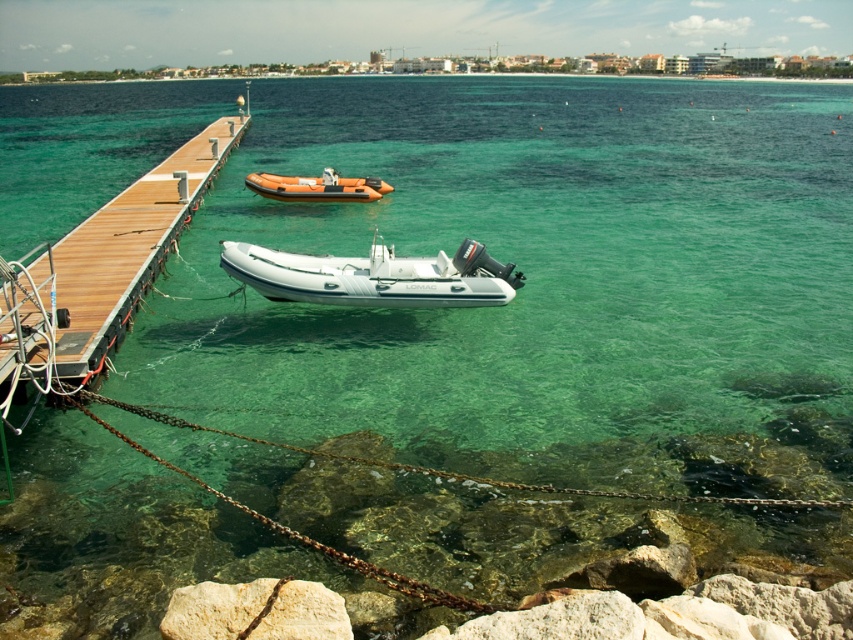
Which is above, white rubber boat at center or white smooth rock at lower center?

white rubber boat at center

Does white rubber boat at center appear over white smooth rock at lower center?

Yes.

Is point (389, 273) behind point (210, 592)?

Yes.

Locate an element on the screen. The image size is (853, 640). white rubber boat at center is located at coordinates (374, 276).

Is wooden dock at left shorter than white smooth rock at lower center?

No, wooden dock at left is not shorter than white smooth rock at lower center.

Is wooden dock at left closer to the viewer compared to white smooth rock at lower center?

No, wooden dock at left is further to the viewer.

Locate an element on the screen. This screenshot has width=853, height=640. wooden dock at left is located at coordinates 99,272.

Between white rubber boat at center and orange rubber dinghy at center, which one is positioned lower?

Positioned lower is white rubber boat at center.

Looking at this image, does white rubber boat at center have a greater width compared to orange rubber dinghy at center?

Yes.

Between point (354, 257) and point (258, 173), which one is positioned behind?

Point (258, 173)

Image resolution: width=853 pixels, height=640 pixels. I want to click on white rubber boat at center, so click(374, 276).